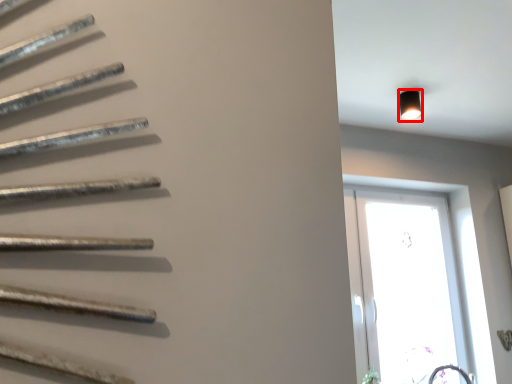
Question: From the image's perspective, considering the relative positions of light fixture (annotated by the red box) and window in the image provided, where is light fixture (annotated by the red box) located with respect to the staircase?

Choices:
 (A) below
 (B) above

Answer: (B)